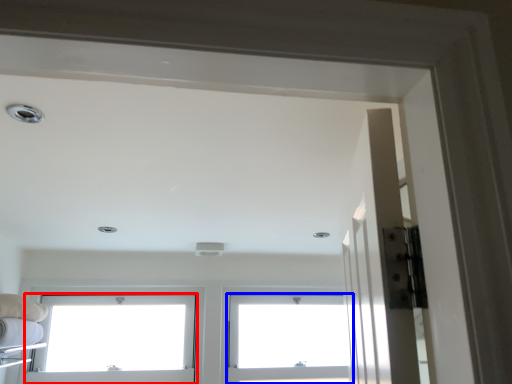
Question: Which object appears farthest to the camera in this image, window (highlighted by a red box) or window (highlighted by a blue box)?

Choices:
 (A) window
 (B) window

Answer: (B)